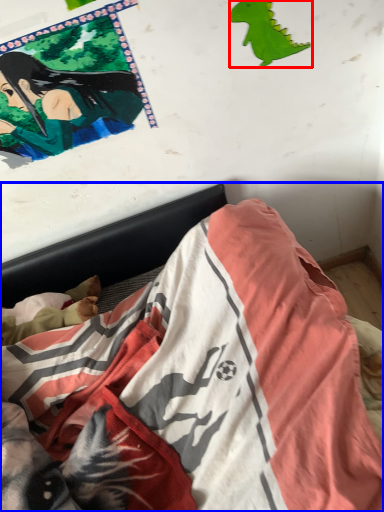
Question: Which object is further to the camera taking this photo, print (highlighted by a red box) or bed (highlighted by a blue box)?

Choices:
 (A) print
 (B) bed

Answer: (A)